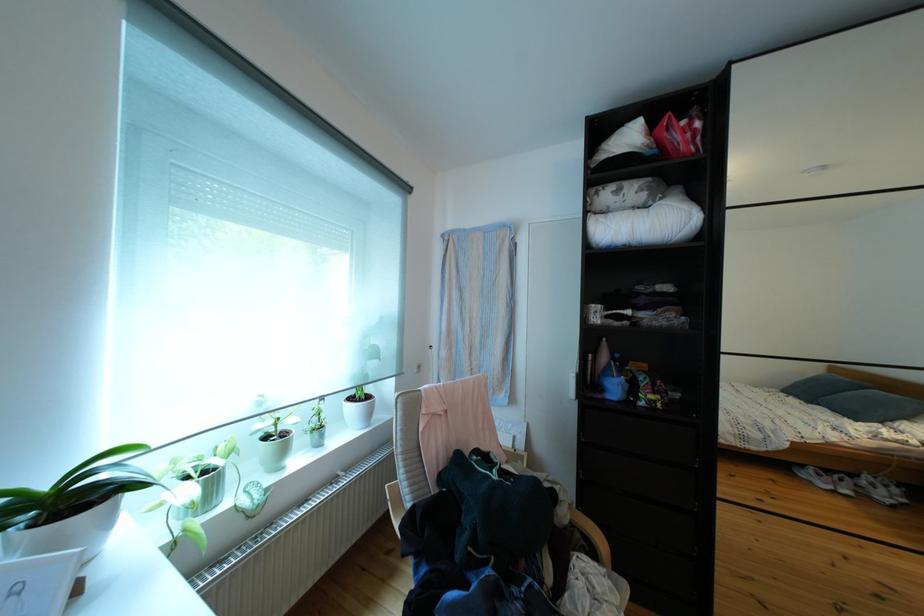
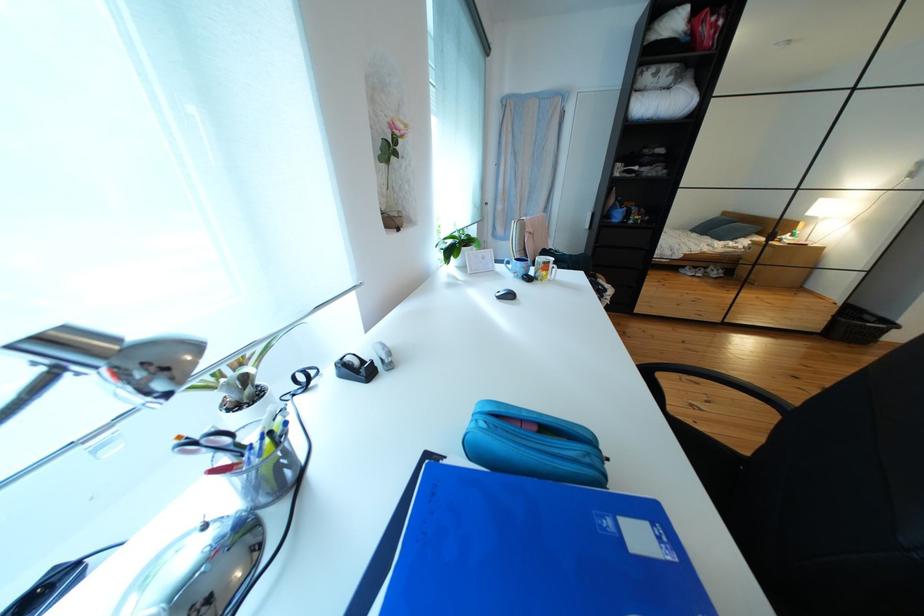
What movement of the cameraman would produce the second image?

The cameraman moved toward left, backward.